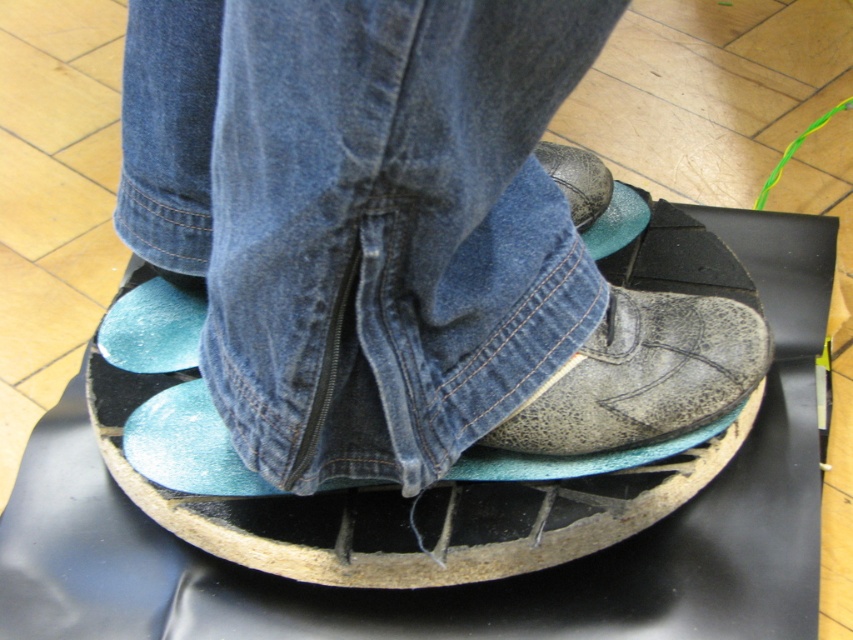
You are a skateboarding instructor checking the stance of a student. The student is standing on a skateboard deck with their teal suede shoe at center and leather shoe at center. Based on the distance between them, can you determine if their feet are positioned in a standard stance or a wider stance?

The distance between the teal suede shoe at center and the leather shoe at center is 19.17 inches. A standard skateboarding stance typically has feet positioned about 12 to 15 inches apart. Since 19.17 inches exceeds this range, the student is likely using a wider stance.

You are standing on a skateboard deck and want to place your left foot at point A and your right foot at point B. If point A is point [245,202] and point B is point [102,328], which foot should you place closer to the front of the deck?

Since point A is in front of point B, you should place your left foot at point A closer to the front of the deck.